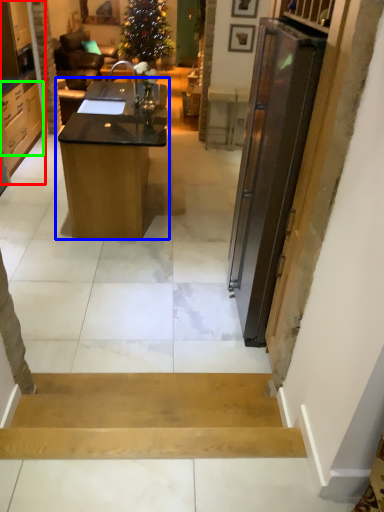
Question: Which is farther away from cabinetry (highlighted by a red box)? desk (highlighted by a blue box) or cabinetry (highlighted by a green box)?

Choices:
 (A) desk
 (B) cabinetry

Answer: (A)